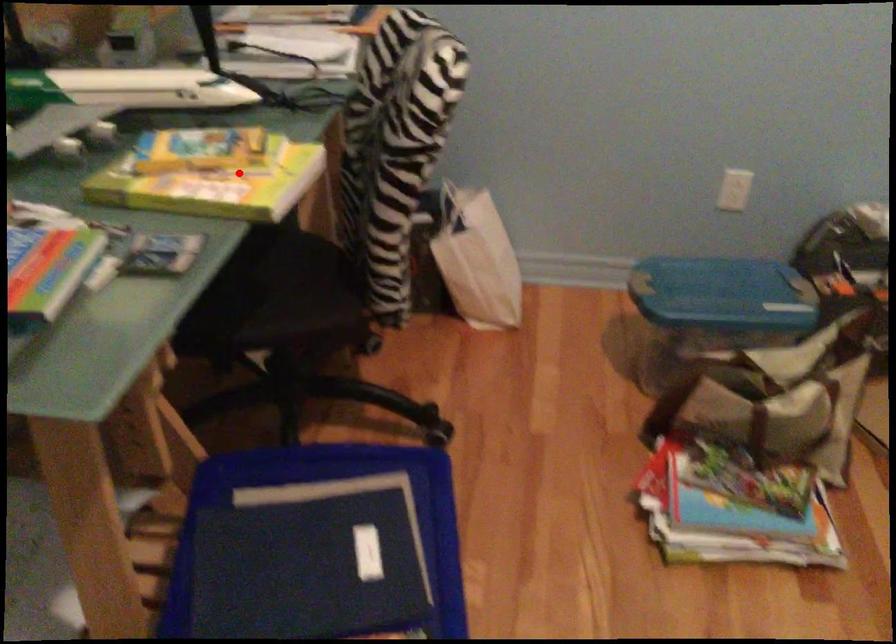
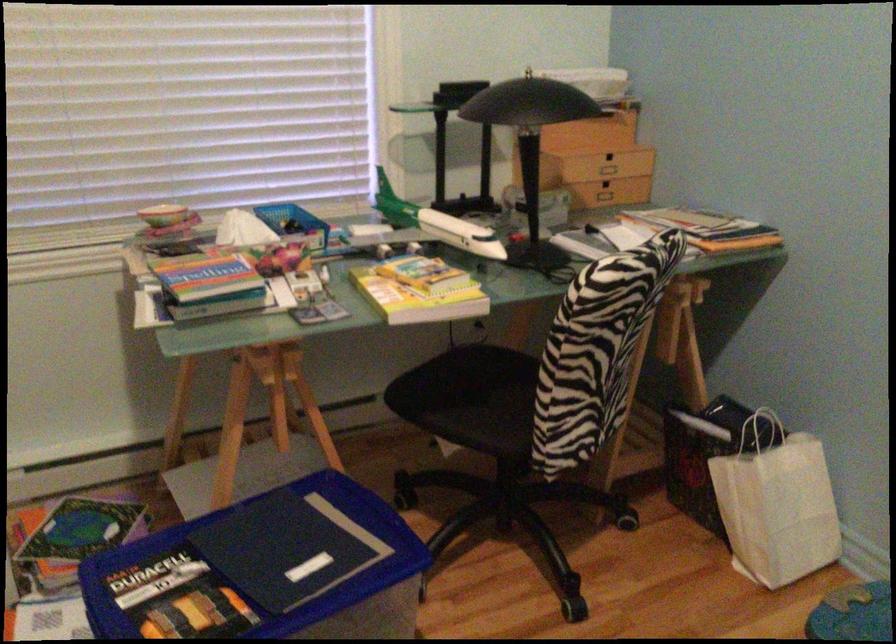
Question: A red point is marked in image1. In image2, is the corresponding 3D point closer to the camera or farther? Reply with the corresponding letter.

Choices:
 (A) The corresponding 3D point is closer.
 (B) The corresponding 3D point is farther.

Answer: (B)